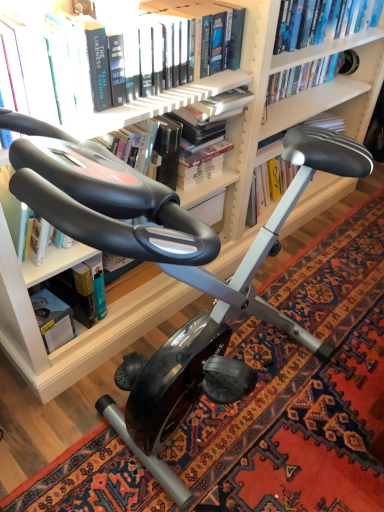
Identify the location of free spot above black rubber exercise bike at center (from a real-world perspective). (270, 362).